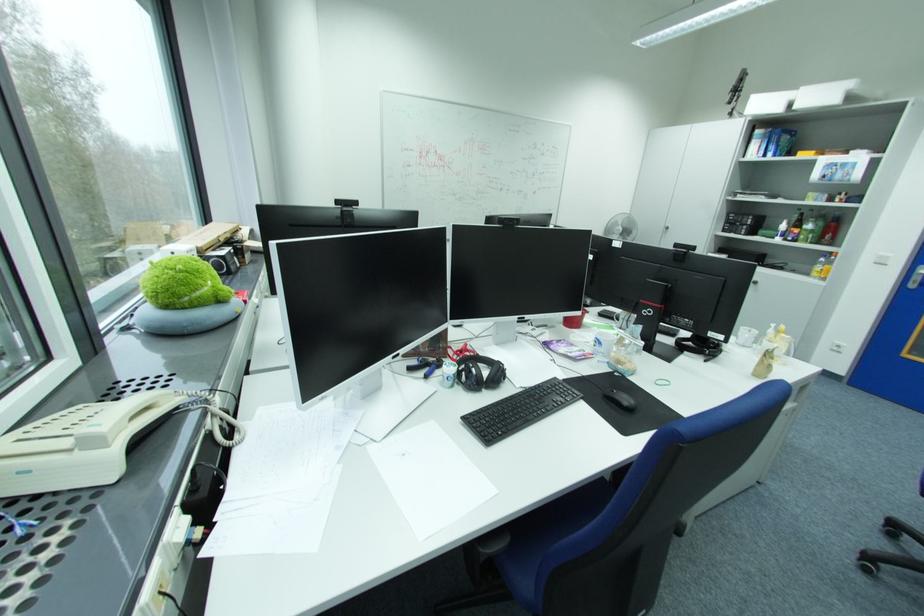
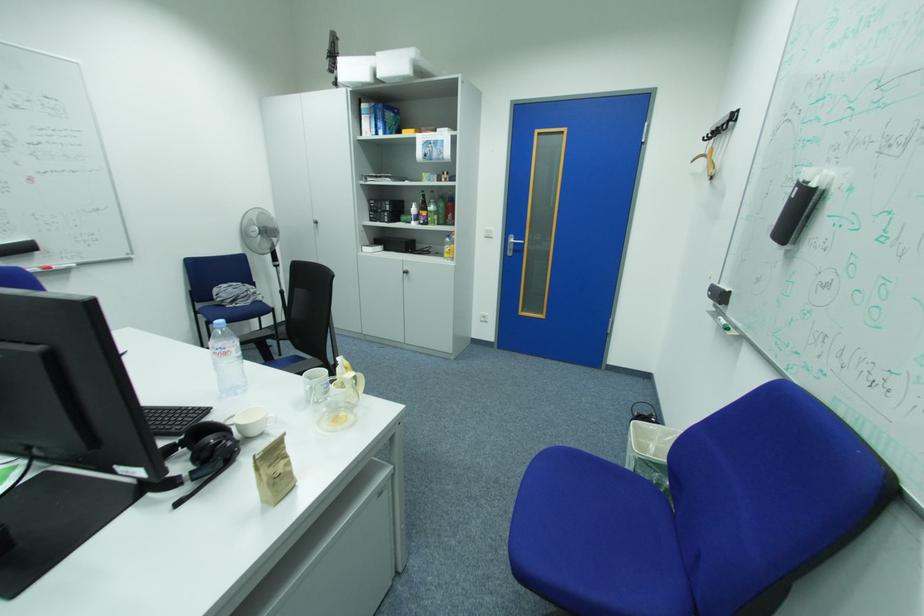
Where in the second image is the point corresponding to the point at 763,283 from the first image?

(415, 273)